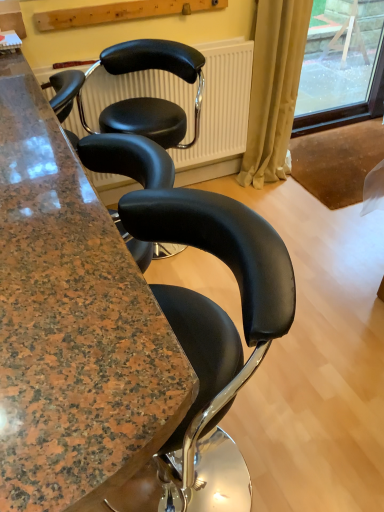
Question: Considering the relative sizes of beige fabric curtain at right and black leather chair at center in the image provided, is beige fabric curtain at right smaller than black leather chair at center?

Choices:
 (A) yes
 (B) no

Answer: (A)

Question: From the image's perspective, is beige fabric curtain at right located beneath black leather chair at center?

Choices:
 (A) no
 (B) yes

Answer: (A)

Question: Does beige fabric curtain at right appear on the right side of black leather chair at center?

Choices:
 (A) no
 (B) yes

Answer: (B)

Question: Is beige fabric curtain at right positioned beyond the bounds of black leather chair at center?

Choices:
 (A) yes
 (B) no

Answer: (A)

Question: Can you confirm if beige fabric curtain at right is thinner than black leather chair at center?

Choices:
 (A) no
 (B) yes

Answer: (B)

Question: Is beige fabric curtain at right further to camera compared to black leather chair at center?

Choices:
 (A) yes
 (B) no

Answer: (A)

Question: Does black leather chair at center have a greater height compared to beige fabric curtain at right?

Choices:
 (A) yes
 (B) no

Answer: (B)

Question: Does black leather chair at center have a lesser width compared to beige fabric curtain at right?

Choices:
 (A) no
 (B) yes

Answer: (A)

Question: Is black leather chair at center behind beige fabric curtain at right?

Choices:
 (A) yes
 (B) no

Answer: (B)

Question: Is black leather chair at center touching beige fabric curtain at right?

Choices:
 (A) no
 (B) yes

Answer: (A)

Question: Is the depth of black leather chair at center less than that of beige fabric curtain at right?

Choices:
 (A) yes
 (B) no

Answer: (A)

Question: Is black leather chair at center aimed at beige fabric curtain at right?

Choices:
 (A) no
 (B) yes

Answer: (A)

Question: Considering the relative sizes of granite countertop at center and black leather chair at center in the image provided, is granite countertop at center shorter than black leather chair at center?

Choices:
 (A) no
 (B) yes

Answer: (A)